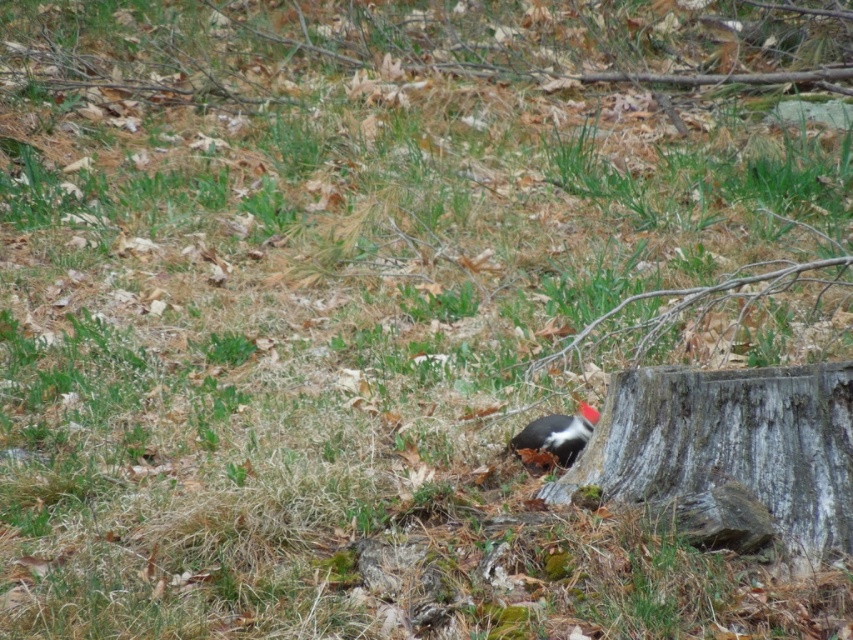
Question: Is gray rough tree trunk at lower right above black matte woodpecker at center?

Choices:
 (A) no
 (B) yes

Answer: (A)

Question: Which point is farther to the camera?

Choices:
 (A) gray rough tree trunk at lower right
 (B) black matte woodpecker at center

Answer: (B)

Question: Where is gray rough tree trunk at lower right located in relation to black matte woodpecker at center in the image?

Choices:
 (A) right
 (B) left

Answer: (A)

Question: Among these points, which one is farthest from the camera?

Choices:
 (A) (619, 413)
 (B) (595, 422)

Answer: (B)

Question: Which object appears farthest from the camera in this image?

Choices:
 (A) gray rough tree trunk at lower right
 (B) black matte woodpecker at center

Answer: (B)

Question: Can you confirm if gray rough tree trunk at lower right is positioned to the right of black matte woodpecker at center?

Choices:
 (A) no
 (B) yes

Answer: (B)